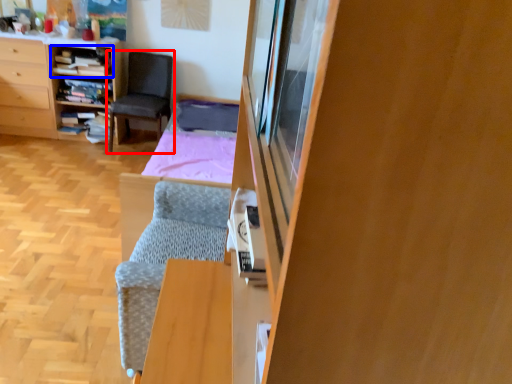
Question: Which point is closer to the camera, chair (highlighted by a red box) or shelf (highlighted by a blue box)?

Choices:
 (A) chair
 (B) shelf

Answer: (A)